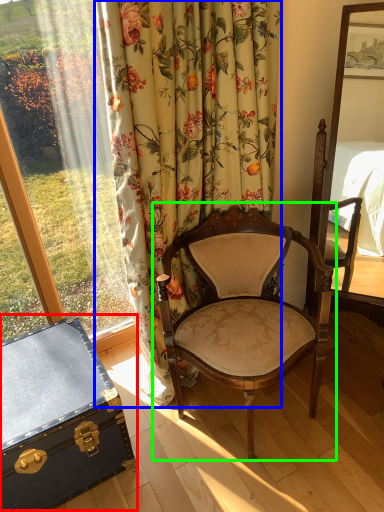
Question: Estimate the real-world distances between objects in this image. Which object is closer to chest (highlighted by a red box), curtain (highlighted by a blue box) or chair (highlighted by a green box)?

Choices:
 (A) curtain
 (B) chair

Answer: (B)